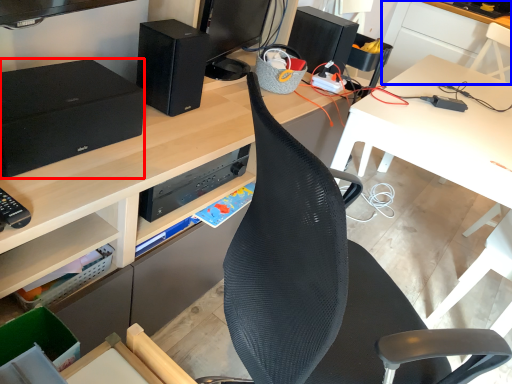
Question: Which of the following is the closest to the observer, speaker (highlighted by a red box) or table (highlighted by a blue box)?

Choices:
 (A) speaker
 (B) table

Answer: (A)